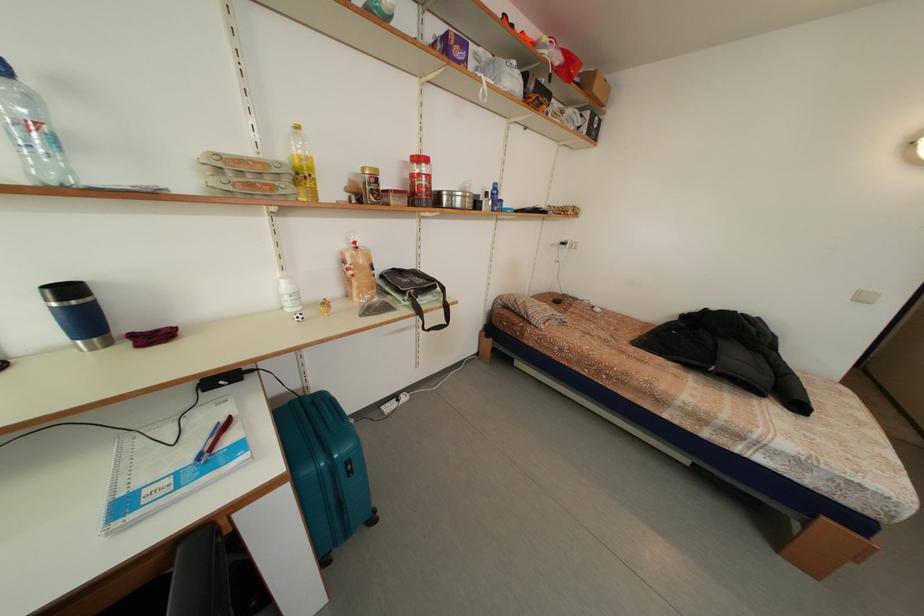
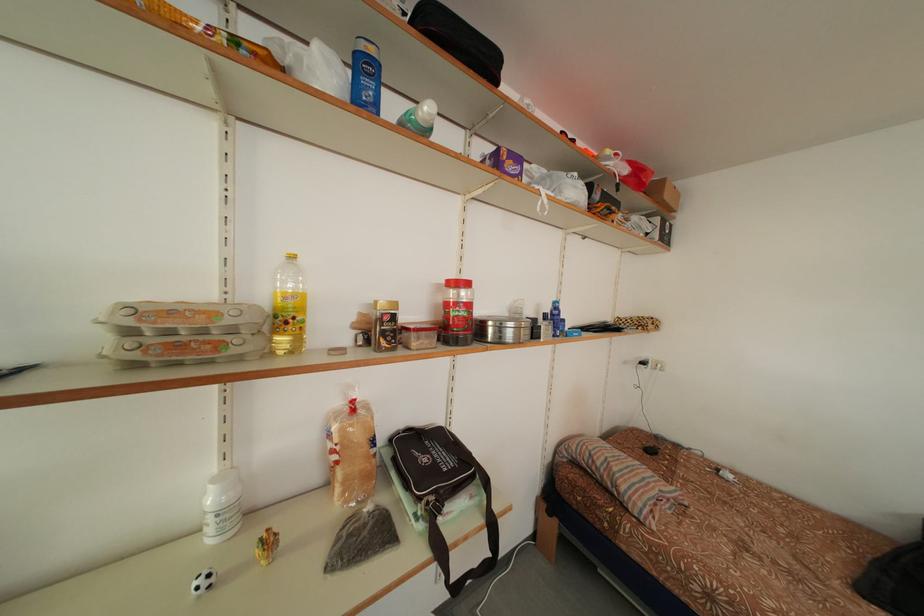
In the second image, find the point that corresponds to [453,204] in the first image.

(499, 334)